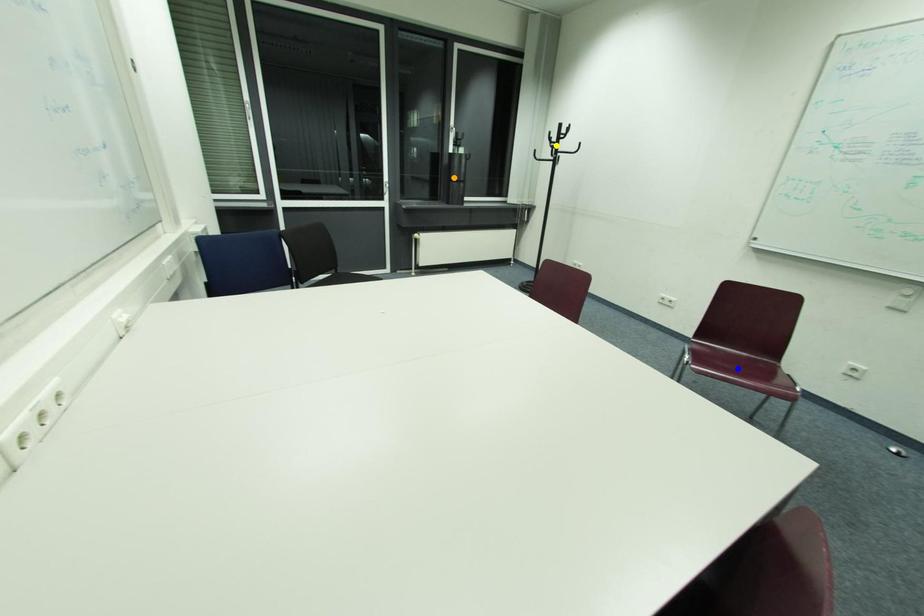
Order these from nearest to farthest:
1. orange point
2. yellow point
3. blue point

blue point, yellow point, orange point